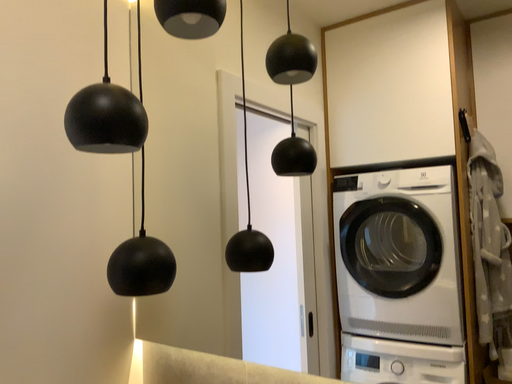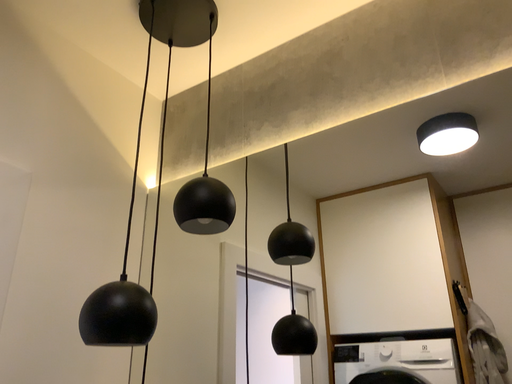
Question: Which way did the camera rotate in the video?

Choices:
 (A) rotated downward
 (B) rotated upward

Answer: (B)